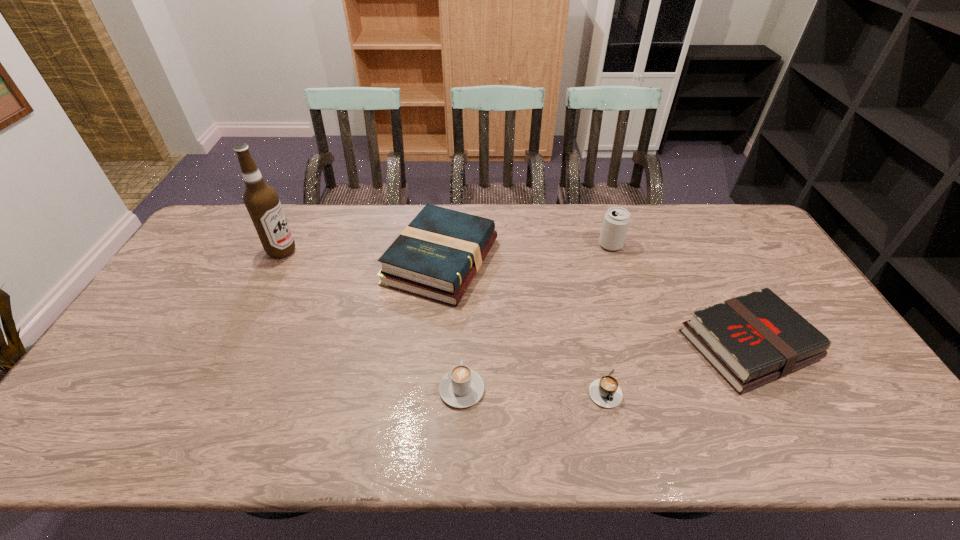
Where is `the right cappuccino`? the right cappuccino is located at coordinates (605, 392).

Where is `free point located on the label of the leftmost object`? This screenshot has height=540, width=960. free point located on the label of the leftmost object is located at coordinates (390, 251).

Where is `vacant area located on the right of the can`? vacant area located on the right of the can is located at coordinates (723, 245).

Find the location of a particular element. This screenshot has width=960, height=540. vacant space situated on the front of the left hardback book is located at coordinates (433, 350).

Locate an element on the screen. This screenshot has height=540, width=960. vacant space situated 0.360m on the left of the right hardback book is located at coordinates (551, 345).

Locate an element on the screen. The image size is (960, 540). free space located to the right of the left cappuccino is located at coordinates (464, 336).

I want to click on vacant point located to the right of the left cappuccino, so click(x=466, y=289).

Identify the location of vacant space situated to the right of the left cappuccino. This screenshot has width=960, height=540. (465, 294).

Identify the location of vacant space located with the handle on the side of the fourth object from left to right. [615, 437].

Locate an element on the screen. The width and height of the screenshot is (960, 540). alcohol that is at the far edge is located at coordinates (261, 200).